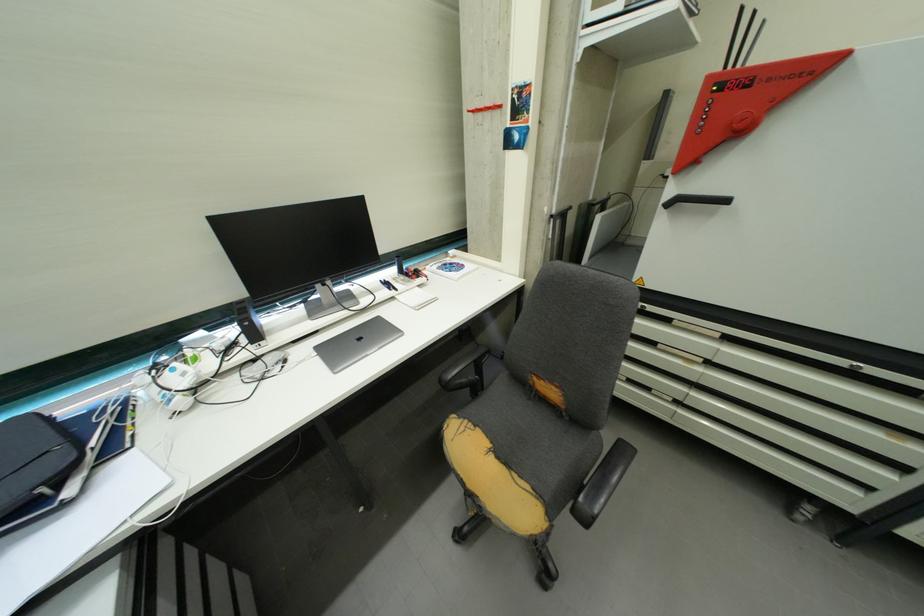
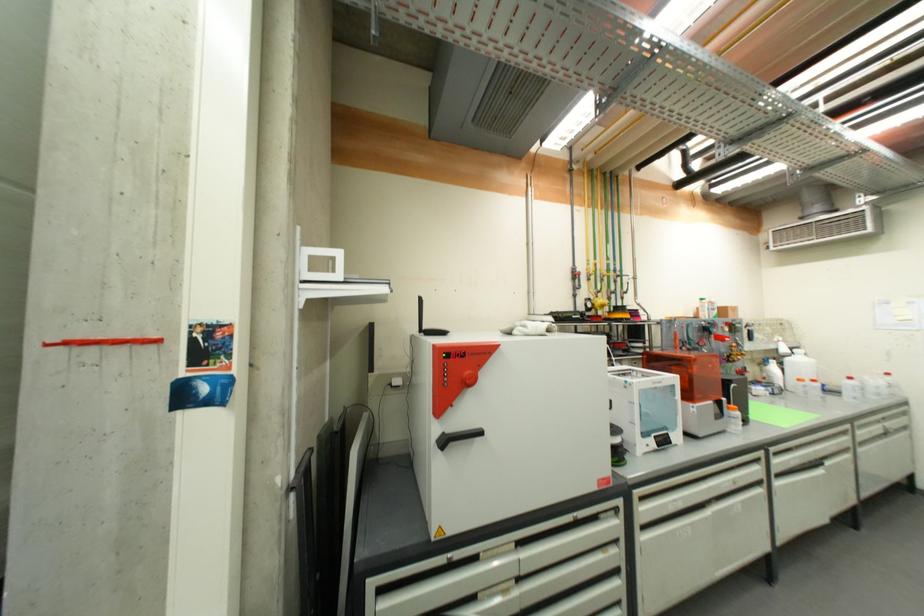
The point at [747,123] is marked in the first image. Where is the corresponding point in the second image?

(476, 381)